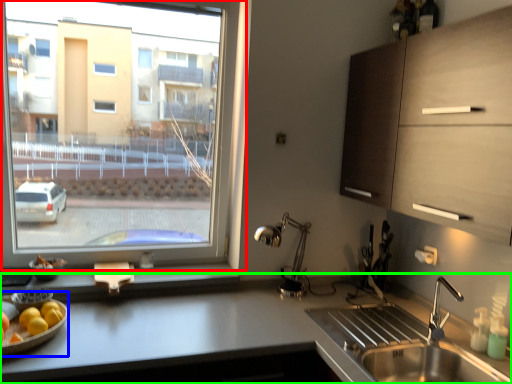
Question: Considering the real-world distances, which object is closest to window (highlighted by a red box)? fruit dish (highlighted by a blue box) or countertop (highlighted by a green box).

Choices:
 (A) fruit dish
 (B) countertop

Answer: (B)